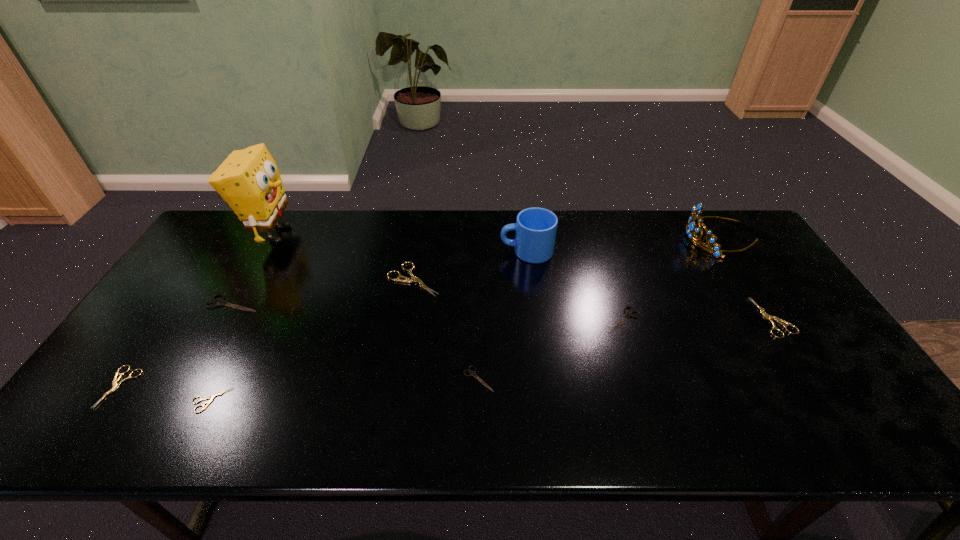
Identify which black shears is located as the second nearest to the sixth object from left to right. Please provide its 2D coordinates. Your answer should be formatted as a tuple, i.e. [(x, y)], where the tuple contains the x and y coordinates of a point satisfying the conditions above.

[(220, 302)]

The image size is (960, 540). Find the location of `black shears object that ranks as the second closest to the shortest object`. black shears object that ranks as the second closest to the shortest object is located at coordinates (472, 373).

Where is `the closest beige shears to the sponge`? The height and width of the screenshot is (540, 960). the closest beige shears to the sponge is located at coordinates (414, 279).

I want to click on the second closest beige shears to the second farthest beige shears, so click(211, 398).

The width and height of the screenshot is (960, 540). What are the coordinates of `vacant region that satisfies the following two spatial constraints: 1. on the side of the mug with the handle; 2. on the front side of the third biggest beige shears` in the screenshot? It's located at (543, 387).

Identify the location of free space that satisfies the following two spatial constraints: 1. on the face of the yellow sponge; 2. on the back side of the fifth shears from left to right. The image size is (960, 540). coord(195,379).

What are the coordinates of `free space that satisfies the following two spatial constraints: 1. on the back side of the smallest beige shears; 2. on the left side of the farthest beige shears` in the screenshot? It's located at (272, 279).

This screenshot has height=540, width=960. In order to click on free spot that satisfies the following two spatial constraints: 1. on the side of the mug with the handle; 2. on the front side of the shortest object in this screenshot , I will do `click(544, 400)`.

Where is `free region that satisfies the following two spatial constraints: 1. on the back side of the third nearest beige shears; 2. on the left side of the nearest black shears`? This screenshot has width=960, height=540. free region that satisfies the following two spatial constraints: 1. on the back side of the third nearest beige shears; 2. on the left side of the nearest black shears is located at coordinates (478, 318).